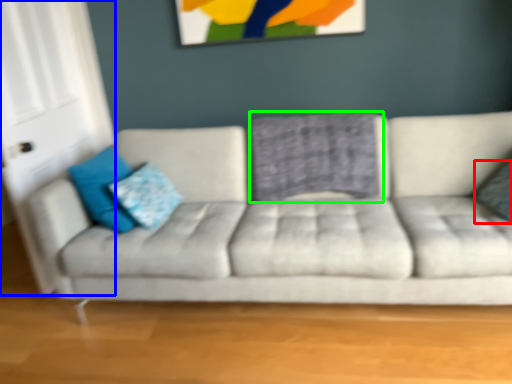
Question: Which object is the farthest from pillow (highlighted by a red box)? Choose among these: glass door (highlighted by a blue box) or pillow (highlighted by a green box).

Choices:
 (A) glass door
 (B) pillow

Answer: (A)